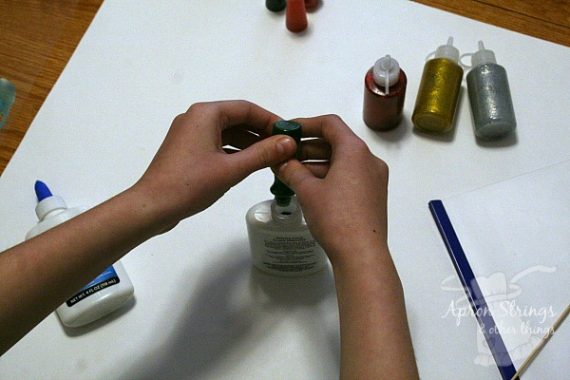
Locate an element on the screen. Image resolution: width=570 pixels, height=380 pixels. workspace is located at coordinates (168, 71).